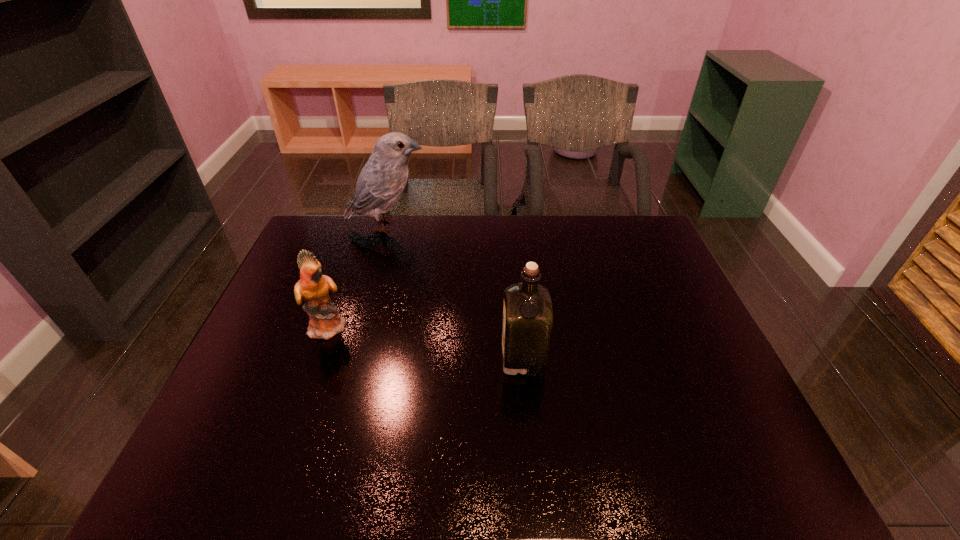
Locate an element on the screen. The height and width of the screenshot is (540, 960). the farther parrot is located at coordinates (381, 181).

Find the location of a particular element. The height and width of the screenshot is (540, 960). the taller parrot is located at coordinates (381, 181).

Find the location of a particular element. the rightmost object is located at coordinates (527, 313).

This screenshot has height=540, width=960. What are the coordinates of `the nearer parrot` in the screenshot? It's located at (313, 287).

Find the location of `vacant space located 0.340m on the front-facing side of the farther parrot`. vacant space located 0.340m on the front-facing side of the farther parrot is located at coordinates (525, 225).

Identify the location of vacant area situated 0.390m on the label of the rightmost object. This screenshot has height=540, width=960. (348, 357).

The image size is (960, 540). Identify the location of free space located on the label of the rightmost object. (x=483, y=357).

This screenshot has width=960, height=540. Find the location of `free spot located on the label of the rightmost object`. free spot located on the label of the rightmost object is located at coordinates (365, 357).

Find the location of `vacant space located 0.210m on the front-facing side of the shorter parrot`. vacant space located 0.210m on the front-facing side of the shorter parrot is located at coordinates (426, 326).

Where is `object that is positioned at the far edge`? This screenshot has width=960, height=540. object that is positioned at the far edge is located at coordinates (381, 181).